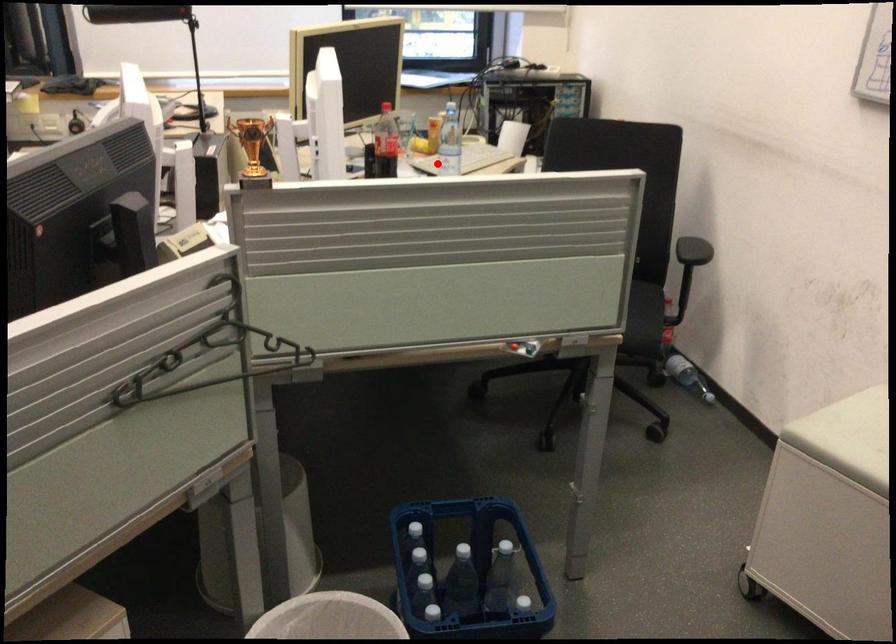
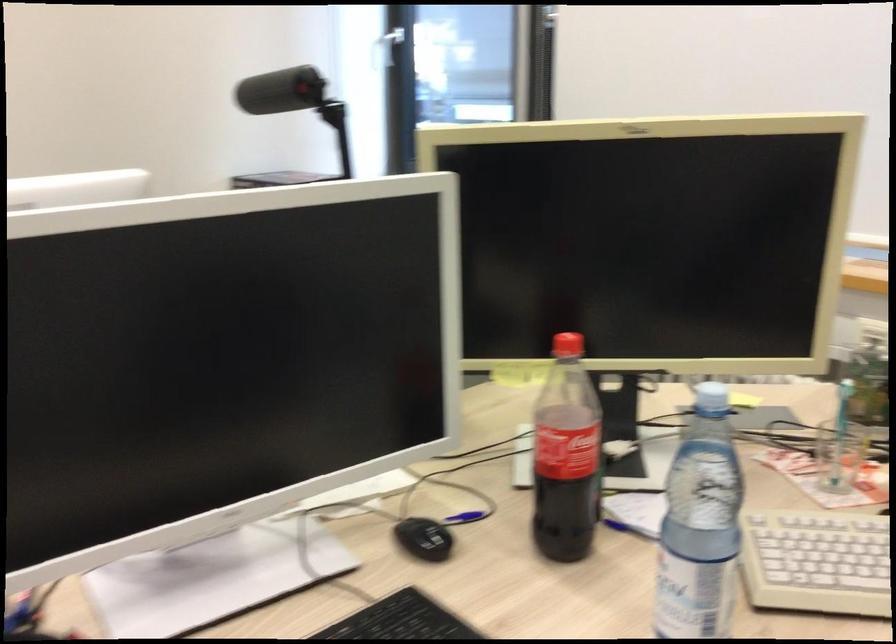
Question: I am providing you with two images of the same scene from different viewpoints. Given a red point in image1, look at the same physical point in image2. Is it:

Choices:
 (A) Closer to the viewpoint
 (B) Farther from the viewpoint

Answer: (A)